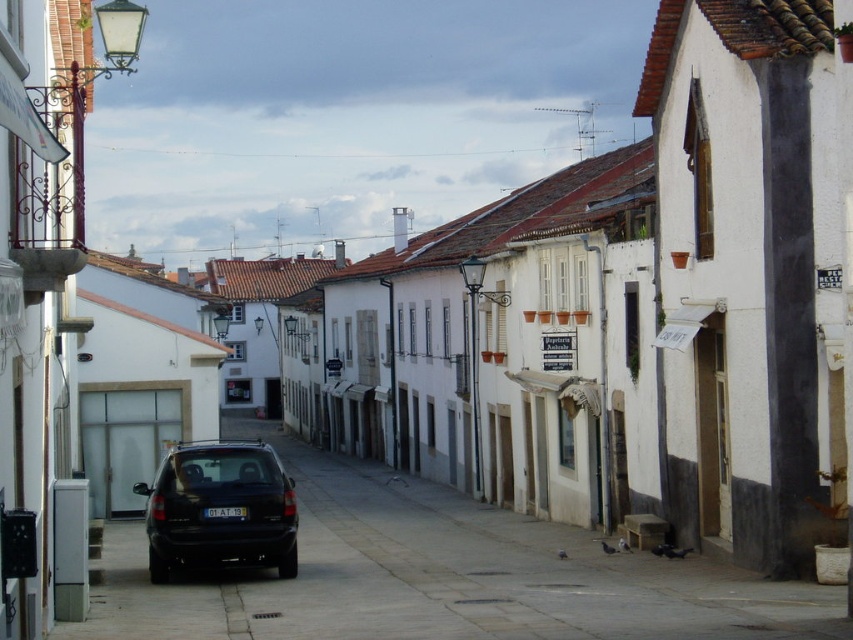
You are standing at the entrance of the street and want to park your car at the exact location where the black matte car at center is currently parked. According to the image, what are the coordinates of the spot you should aim for?

The coordinates of the spot where the black matte car at center is parked are at point (440, 576).

You are driving a car that is 15 feet long and need to park it in this narrow street. There are two cars here, a black matte car at center and a matte black car at center. Can you fit your car between them without touching either?

The distance between the black matte car at center and the matte black car at center is 35.79 feet. Since your car is only 15 feet long, there is enough space to park between them without touching either.